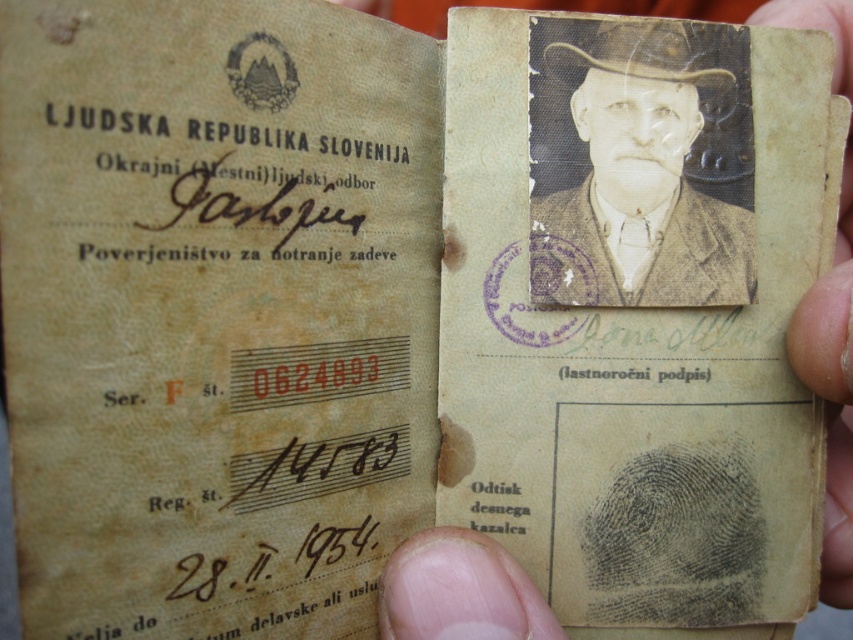
Question: Does black textured hat at upper center have a larger size compared to flesh-toned skin at lower right?

Choices:
 (A) no
 (B) yes

Answer: (A)

Question: Does black textured hat at upper center lie behind flesh-toned skin at lower right?

Choices:
 (A) yes
 (B) no

Answer: (A)

Question: Among these objects, which one is farthest from the camera?

Choices:
 (A) black textured hat at upper center
 (B) flesh-toned skin at lower right

Answer: (A)

Question: Can you confirm if black textured hat at upper center is bigger than flesh-toned skin at lower right?

Choices:
 (A) yes
 (B) no

Answer: (B)